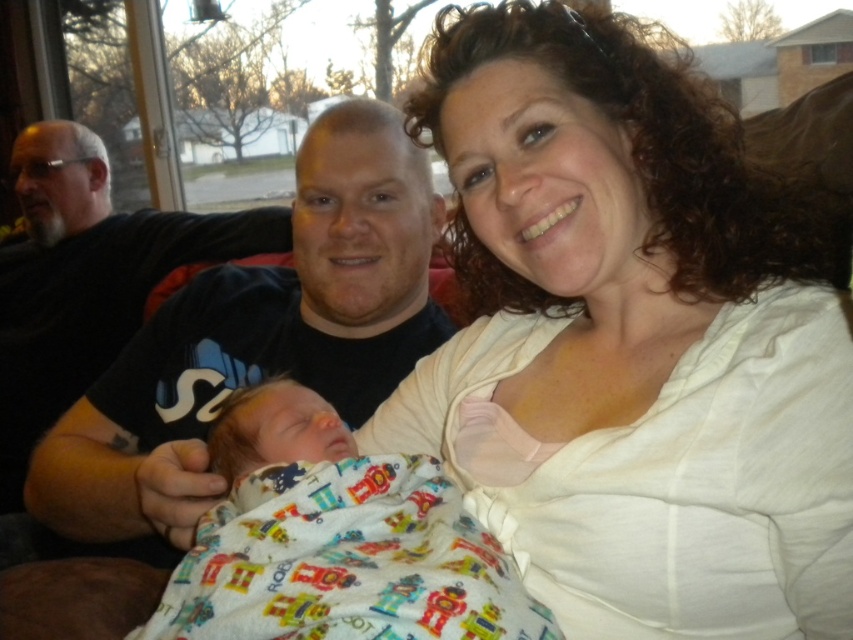
You are a fashion designer observing this family photo. You need to determine which of the two shirts, the white soft shirt at upper right or the black cotton shirt at center, would require more fabric to produce. Based on the image, which one would need more fabric?

The black cotton shirt at center requires more fabric because it is larger in size compared to the white soft shirt at upper right.